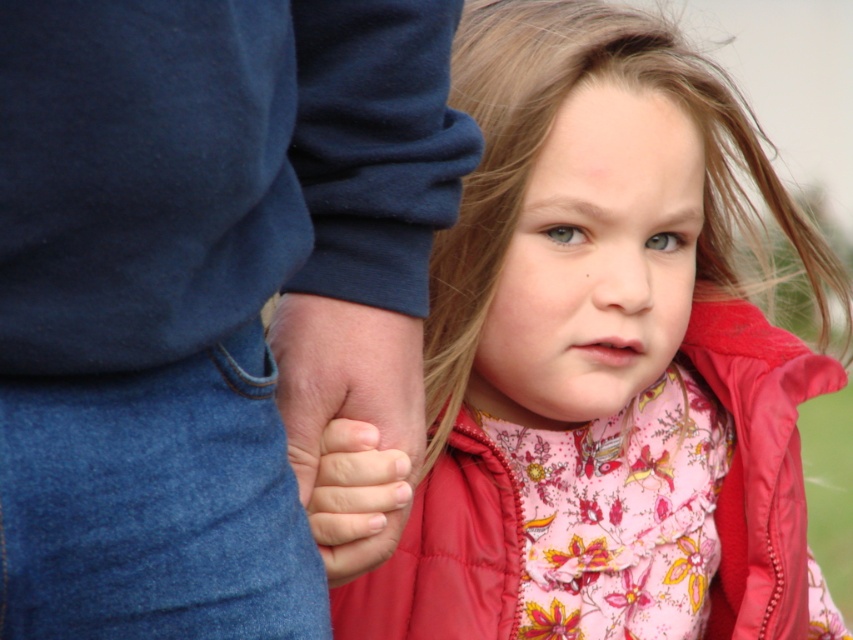
Based on the photo, you are a photographer adjusting your camera settings. You notice two points in the image at coordinates point (495, 472) and point (323, 358). Which point is closer to the camera lens?

Point (495, 472) is further to the viewer than point (323, 358), so point (323, 358) is closer to the camera lens.

You are a fashion designer observing the image. You need to decide which item would require more fabric to create between the floral fabric dress at center and the smooth skin hand at center. Which one would need more fabric?

The floral fabric dress at center has a larger size compared to the smooth skin hand at center, so it would require more fabric to create.